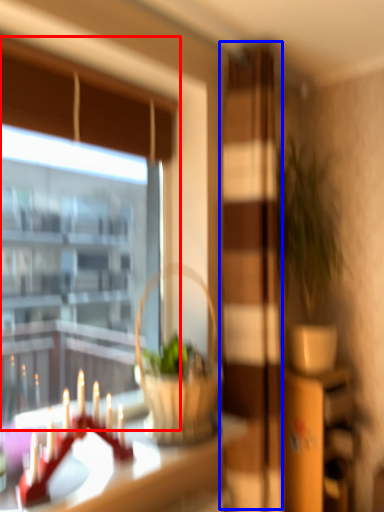
Question: Which of the following is the farthest to the observer, window (highlighted by a red box) or screen door (highlighted by a blue box)?

Choices:
 (A) window
 (B) screen door

Answer: (B)